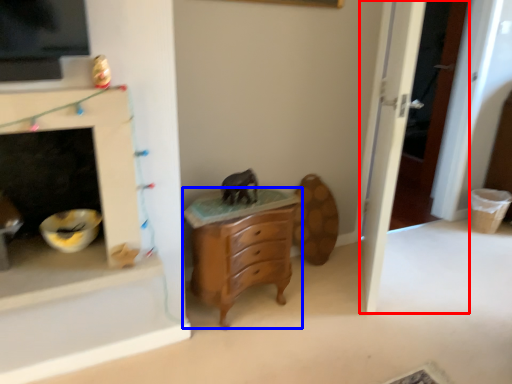
Question: Which object is closer to the camera taking this photo, door (highlighted by a red box) or chest of drawers (highlighted by a blue box)?

Choices:
 (A) door
 (B) chest of drawers

Answer: (A)